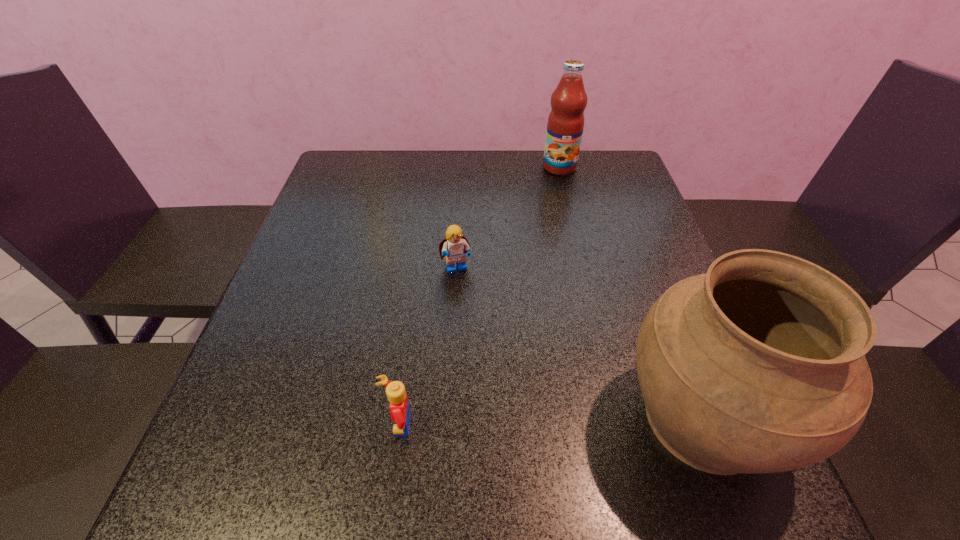
Locate an element on the screen. Image resolution: width=960 pixels, height=540 pixels. free spot on the desktop that is between the left Lego and the urn and is positioned on the front-facing side of the farther Lego is located at coordinates (511, 423).

The height and width of the screenshot is (540, 960). Identify the location of free space on the desktop that is between the nearer Lego and the urn and is positioned on the front label of the fruit juice. (553, 422).